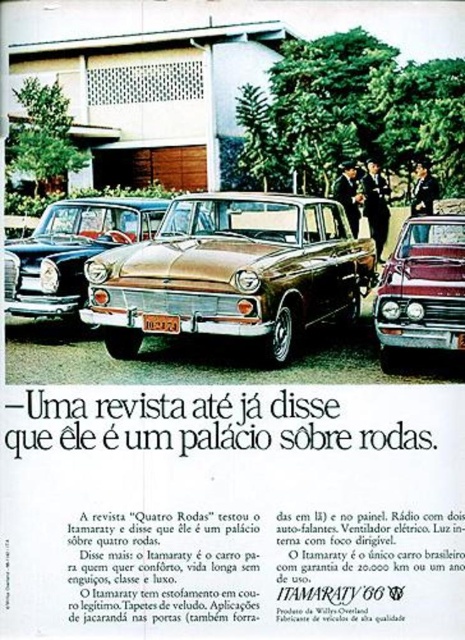
Question: Which point is closer to the camera?

Choices:
 (A) gold metallic car at center
 (B) gold metallic sedan at center

Answer: (A)

Question: Can you confirm if gold metallic car at center is thinner than gold metallic sedan at center?

Choices:
 (A) yes
 (B) no

Answer: (B)

Question: Based on their relative distances, which object is nearer to the yellow plastic license plate at center?

Choices:
 (A) shiny maroon sedan at right
 (B) gold metallic sedan at center

Answer: (B)

Question: Which point is closer to the camera?

Choices:
 (A) (167, 316)
 (B) (285, 205)

Answer: (A)

Question: Is gold metallic car at center smaller than gold metallic sedan at center?

Choices:
 (A) no
 (B) yes

Answer: (A)

Question: Can you confirm if gold metallic sedan at center is thinner than shiny maroon sedan at right?

Choices:
 (A) yes
 (B) no

Answer: (B)